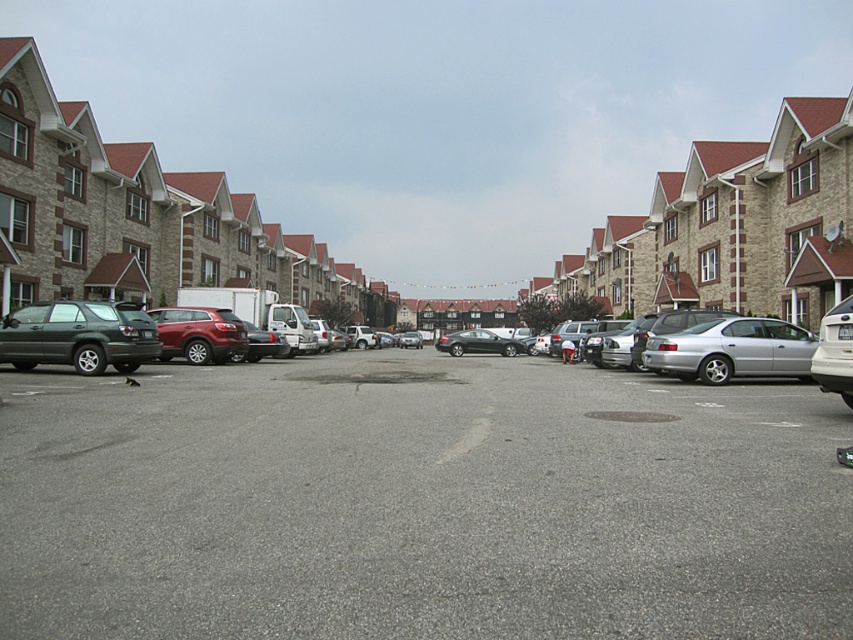
You are a delivery driver who needs to park your truck in the parking lot. You see the satin red suv at center and the silver metallic sedan at right. Which vehicle is blocking your path to the parking spot behind them?

The satin red suv at center is blocking your path to the parking spot behind them because it is positioned over the silver metallic sedan at right, meaning it is closer to you and in front of the sedan.